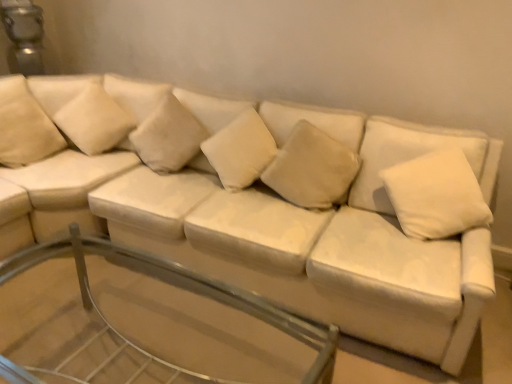
Question: Is point (435, 218) positioned closer to the camera than point (328, 359)?

Choices:
 (A) farther
 (B) closer

Answer: (A)

Question: From the image's perspective, is white soft pillow at upper right, the 6th pillow viewed from the left, located above or below transparent glass table at center?

Choices:
 (A) above
 (B) below

Answer: (A)

Question: Which object is positioned farthest from the suede-like beige pillow at upper left, the 1th pillow when ordered from left to right?

Choices:
 (A) white soft cushion at upper left, marked as the second pillow in a left-to-right arrangement
 (B) beige fabric pillow at center, which ranks as the 3th pillow in left-to-right order
 (C) white soft pillow at upper right, the 6th pillow viewed from the left
 (D) white soft cushion at center, which ranks as the fourth pillow in left-to-right order
 (E) transparent glass table at center

Answer: (C)

Question: Which is farther from the beige fabric pillow at center, the fourth pillow viewed from the right?

Choices:
 (A) transparent glass table at center
 (B) suede-like beige pillow at upper left, which is the 6th pillow in right-to-left order
 (C) white soft cushion at center, placed as the 3th pillow when sorted from right to left
 (D) white soft cushion at upper left, the 5th pillow viewed from the right
 (E) suede-like beige pillow at center, the 2th pillow when ordered from right to left

Answer: (A)